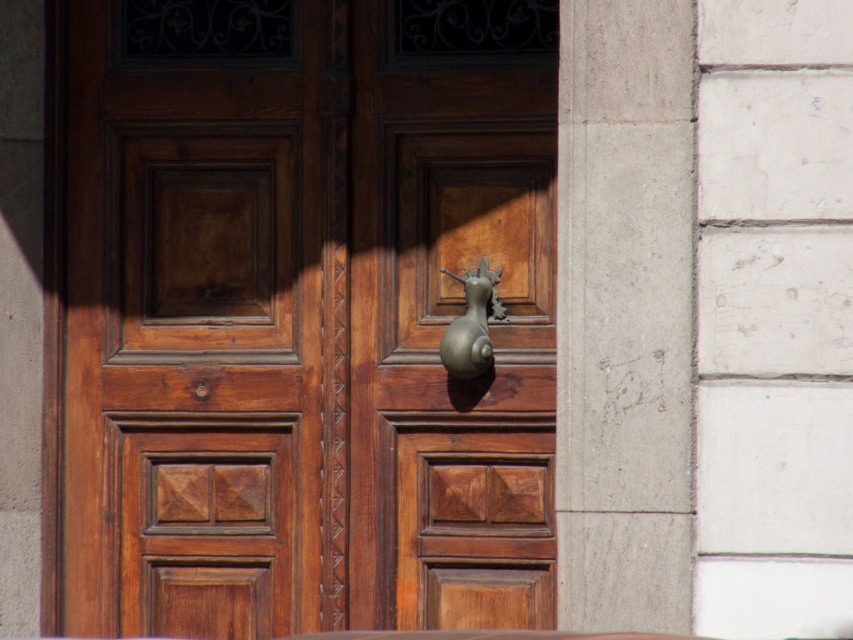
Based on the photo, you are a delivery person with a cart that is 1.2 meters wide. You need to pass through the space between the matte wood door at center and the gray concrete pillar at center. Can your cart fit through the space between them?

The distance between the matte wood door at center and the gray concrete pillar at center is 1.13 meters, which is narrower than your cart width of 1.2 meters. Therefore, your cart cannot fit through the space between them.